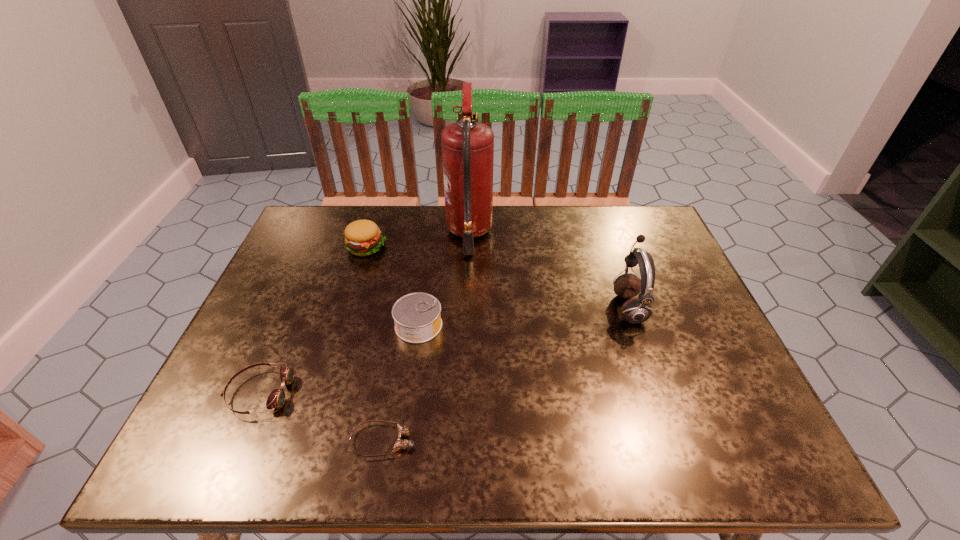
Locate which object is the closest to the earphone. Please provide its 2D coordinates. Your answer should be formatted as a tuple, i.e. [(x, y)], where the tuple contains the x and y coordinates of a point satisfying the conditions above.

[(467, 146)]

Select which object is the third closest to the shorter goggles. Please provide its 2D coordinates. Your answer should be formatted as a tuple, i.e. [(x, y)], where the tuple contains the x and y coordinates of a point satisfying the conditions above.

[(362, 237)]

Locate an element on the screen. vacant space that satisfies the following two spatial constraints: 1. on the front side of the can; 2. through the lenses of the second nearest object is located at coordinates (409, 393).